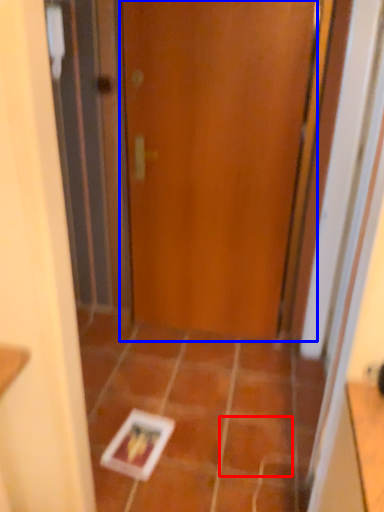
Question: Which object is closer to the camera taking this photo, ceramic tile (highlighted by a red box) or door (highlighted by a blue box)?

Choices:
 (A) ceramic tile
 (B) door

Answer: (A)